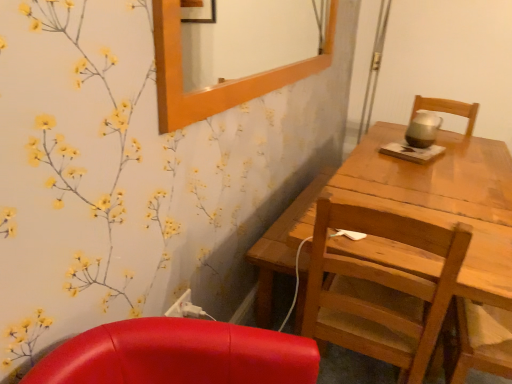
Question: From a real-world perspective, is white plastic power outlet at lower center physically below wooden chair at right?

Choices:
 (A) yes
 (B) no

Answer: (A)

Question: Considering the relative sizes of white plastic power outlet at lower center and wooden chair at right in the image provided, is white plastic power outlet at lower center wider than wooden chair at right?

Choices:
 (A) yes
 (B) no

Answer: (B)

Question: From the image's perspective, is white plastic power outlet at lower center located beneath wooden chair at right?

Choices:
 (A) no
 (B) yes

Answer: (A)

Question: Considering the relative positions of white plastic power outlet at lower center and wooden chair at right in the image provided, is white plastic power outlet at lower center in front of wooden chair at right?

Choices:
 (A) no
 (B) yes

Answer: (A)

Question: Can you confirm if white plastic power outlet at lower center is positioned to the right of wooden chair at right?

Choices:
 (A) no
 (B) yes

Answer: (A)

Question: Is white plastic power outlet at lower center positioned with its back to wooden chair at right?

Choices:
 (A) no
 (B) yes

Answer: (A)

Question: Is wooden frame at upper center to the right of wooden chair at right from the viewer's perspective?

Choices:
 (A) yes
 (B) no

Answer: (B)

Question: Is wooden frame at upper center bigger than wooden chair at right?

Choices:
 (A) no
 (B) yes

Answer: (A)

Question: Does wooden frame at upper center have a greater width compared to wooden chair at right?

Choices:
 (A) no
 (B) yes

Answer: (A)

Question: Is wooden frame at upper center behind wooden chair at right?

Choices:
 (A) yes
 (B) no

Answer: (B)

Question: Is wooden frame at upper center taller than wooden chair at right?

Choices:
 (A) yes
 (B) no

Answer: (B)

Question: Does wooden frame at upper center have a smaller size compared to wooden chair at right?

Choices:
 (A) yes
 (B) no

Answer: (A)

Question: From a real-world perspective, is wooden frame at upper center located beneath white plastic power outlet at lower center?

Choices:
 (A) yes
 (B) no

Answer: (B)